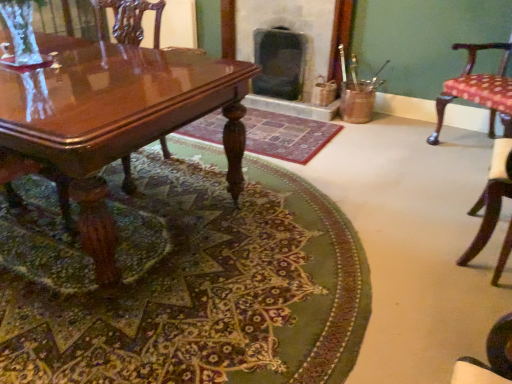
You are a GUI agent. You are given a task and a screenshot of the screen. Output one action in this format:
    pyautogui.click(x=<x>, y=<y>)
    Task: Click on the free space to the left of patterned fabric cushion at right, which is the 2th chair from right to left
    The image size is (512, 384).
    Given the screenshot: What is the action you would take?
    pos(429,252)